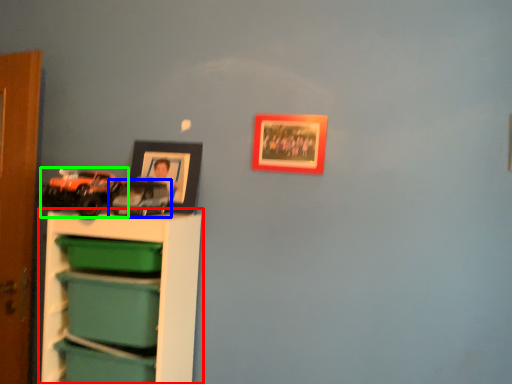
Question: Which is nearer to the shelf (highlighted by a red box)? toy (highlighted by a blue box) or toy (highlighted by a green box).

Choices:
 (A) toy
 (B) toy

Answer: (B)